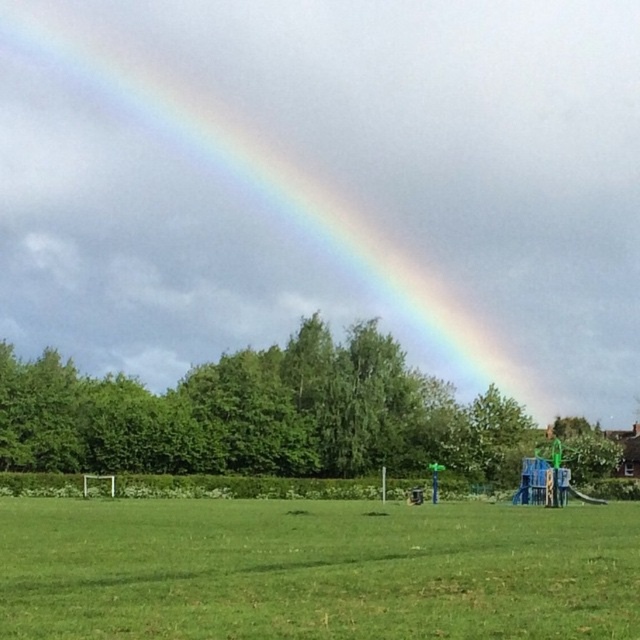
Consider the image. You are a photographer trying to capture the rainbow at upper center and the green grassy field at lower center in a single shot. Which object should you focus on first if you want to ensure both are in the frame?

The rainbow at upper center is above the green grassy field at lower center, so focusing on the rainbow first will help ensure both are included in the frame.

You are a photographer trying to capture the entire rainbow at upper center and green grassy field at lower center in one frame. Based on their sizes, which object would require you to adjust your camera angle more to ensure both fit in the photo?

The rainbow at upper center has a greater width than the green grassy field at lower center, so you would need to adjust your camera angle more to accommodate its larger size to ensure both fit in the photo.

You are standing in the park and want to take a photo of the rainbow at upper center and the green grassy field at lower center. Which object should you focus on first to ensure both are in sharp focus?

You should focus on the rainbow at upper center first because it is closer to you than the green grassy field at lower center, so adjusting focus from near to far will help both be in sharp focus.